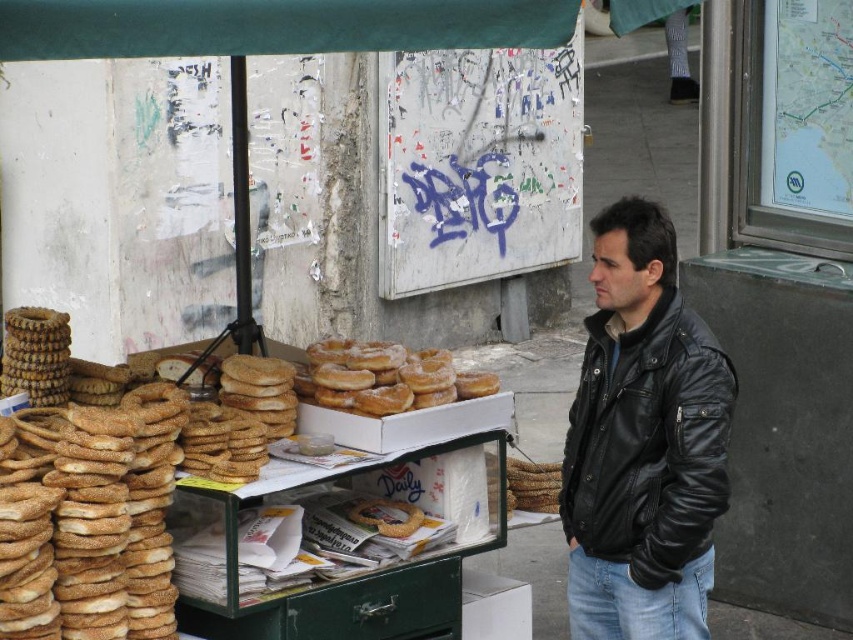
Which is more to the right, black leather jacket at right or sugared doughnut at center?

black leather jacket at right is more to the right.

Can you confirm if black leather jacket at right is positioned below sugared doughnut at center?

Yes, black leather jacket at right is below sugared doughnut at center.

Who is more distant from viewer, [688,506] or [303,387]?

Point [303,387]

Find the location of a particular element. The image size is (853, 640). black leather jacket at right is located at coordinates (648, 442).

Is black leather jacket at right thinner than slightly toasted bagel at center?

Incorrect, black leather jacket at right's width is not less than slightly toasted bagel at center's.

Which is above, black leather jacket at right or slightly toasted bagel at center?

black leather jacket at right is higher up.

Who is more forward, (601, 531) or (370, 525)?

Point (601, 531)

At what (x,y) coordinates should I click in order to perform the action: click on black leather jacket at right. Please return your answer as a coordinate pair (x, y). Looking at the image, I should click on (648, 442).

Does point (383, 364) come behind point (378, 532)?

Yes.

In the scene shown: Can you confirm if sugared doughnut at center is thinner than slightly toasted bagel at center?

No, sugared doughnut at center is not thinner than slightly toasted bagel at center.

Between point (409, 401) and point (416, 509), which one is positioned in front?

Point (409, 401)

Image resolution: width=853 pixels, height=640 pixels. In order to click on sugared doughnut at center in this screenshot , I will do `click(386, 378)`.